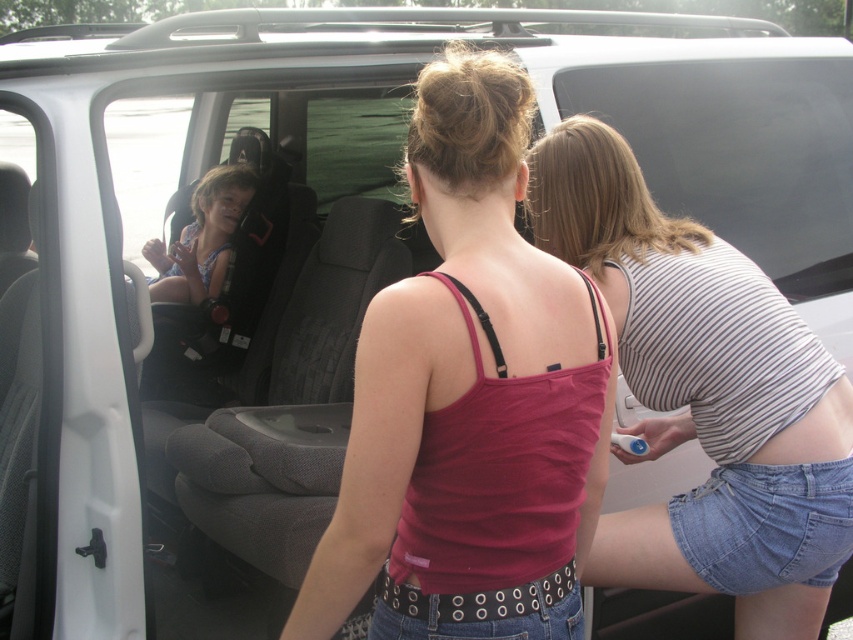
Can you confirm if striped cotton tank top at center is positioned to the right of matte blue swimsuit at center?

Indeed, striped cotton tank top at center is positioned on the right side of matte blue swimsuit at center.

Looking at this image, how distant is striped cotton tank top at center from matte blue swimsuit at center?

striped cotton tank top at center and matte blue swimsuit at center are 1.93 meters apart from each other.

Which is behind, point (721, 388) or point (160, 289)?

Point (160, 289)

At what (x,y) coordinates should I click in order to perform the action: click on striped cotton tank top at center. Please return your answer as a coordinate pair (x, y). This screenshot has height=640, width=853. Looking at the image, I should click on tap(701, 390).

Which is behind, point (529, 579) or point (560, 150)?

The point (560, 150) is more distant.

Image resolution: width=853 pixels, height=640 pixels. Describe the element at coordinates (468, 397) in the screenshot. I see `pink fabric tank top at center` at that location.

Which is in front, point (489, 301) or point (585, 148)?

Positioned in front is point (489, 301).

Locate an element on the screen. pink fabric tank top at center is located at coordinates (468, 397).

Between point (518, 620) and point (198, 292), which one is positioned behind?

The point (198, 292) is behind.

Does pink fabric tank top at center have a lesser width compared to matte blue swimsuit at center?

Incorrect, pink fabric tank top at center's width is not less than matte blue swimsuit at center's.

Is point (421, 506) in front of point (180, 276)?

Yes.

Locate an element on the screen. This screenshot has height=640, width=853. pink fabric tank top at center is located at coordinates (468, 397).